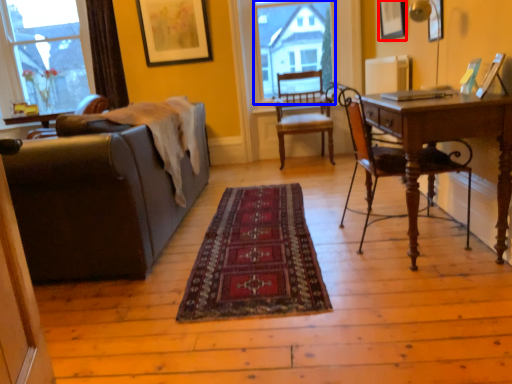
Question: Among these objects, which one is farthest to the camera, picture frame (highlighted by a red box) or bay window (highlighted by a blue box)?

Choices:
 (A) picture frame
 (B) bay window

Answer: (B)